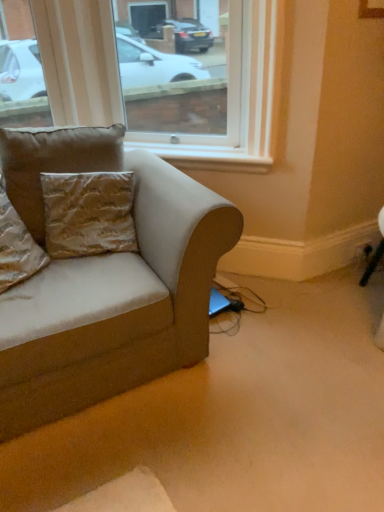
Describe the element at coordinates (364, 252) in the screenshot. This screenshot has height=512, width=384. I see `black plastic outlet at lower right` at that location.

Where is `white painted wood at upper center`? The image size is (384, 512). white painted wood at upper center is located at coordinates (209, 158).

Find the location of a particular element. This screenshot has width=384, height=512. suede-like beige couch at left is located at coordinates (106, 282).

From a real-world perspective, which object stands above the other?

From a 3D spatial view, suede-like beige couch at left is above.

Considering the sizes of objects black plastic outlet at lower right and suede-like beige couch at left in the image provided, who is wider, black plastic outlet at lower right or suede-like beige couch at left?

Wider between the two is suede-like beige couch at left.

Is suede-like beige couch at left inside black plastic outlet at lower right?

No, suede-like beige couch at left is not a part of black plastic outlet at lower right.

Considering the relative positions of black plastic outlet at lower right and suede-like beige couch at left in the image provided, is black plastic outlet at lower right to the left of suede-like beige couch at left from the viewer's perspective?

In fact, black plastic outlet at lower right is to the right of suede-like beige couch at left.

How many degrees apart are the facing directions of black plastic outlet at lower right and white painted wood at upper center?

There is a 40.5-degree angle between the facing directions of black plastic outlet at lower right and white painted wood at upper center.

Which is in front, point (366, 249) or point (145, 145)?

The point (145, 145) is closer to the camera.

Which of these two, black plastic outlet at lower right or white painted wood at upper center, stands shorter?

With less height is black plastic outlet at lower right.

Is black plastic outlet at lower right further to the viewer compared to white painted wood at upper center?

Yes, the depth of black plastic outlet at lower right is greater than that of white painted wood at upper center.

Consider the image. Does gold textured pillow at left, the 1th pillow viewed from the left, have a lesser height compared to white painted wood at upper center?

No, gold textured pillow at left, the 1th pillow viewed from the left, is not shorter than white painted wood at upper center.

Considering the points (14, 236) and (243, 150), which point is in front, point (14, 236) or point (243, 150)?

The point (14, 236) is closer.

Is gold textured pillow at left, positioned as the second pillow in right-to-left order, oriented towards white painted wood at upper center?

No, gold textured pillow at left, positioned as the second pillow in right-to-left order, is not facing towards white painted wood at upper center.

Does gold textured pillow at left, positioned as the second pillow in right-to-left order, have a larger size compared to white painted wood at upper center?

Yes.

Looking at this image, from a real-world perspective, is white painted wood at upper center physically below gold textured pillow at upper left, which is counted as the second pillow, starting from the left?

Yes, from a real-world perspective, white painted wood at upper center is under gold textured pillow at upper left, which is counted as the second pillow, starting from the left.

Can you confirm if white painted wood at upper center is shorter than gold textured pillow at upper left, which ranks as the first pillow in right-to-left order?

Yes.

Would you say white painted wood at upper center is outside gold textured pillow at upper left, which is counted as the second pillow, starting from the left?

Yes.

Does white painted wood at upper center have a lesser width compared to gold textured pillow at upper left, which ranks as the first pillow in right-to-left order?

Correct, the width of white painted wood at upper center is less than that of gold textured pillow at upper left, which ranks as the first pillow in right-to-left order.

Looking at this image, which of these two, gold textured pillow at upper left, which is counted as the second pillow, starting from the left, or white painted wood at upper center, stands taller?

gold textured pillow at upper left, which is counted as the second pillow, starting from the left, is taller.

From a real-world perspective, between gold textured pillow at upper left, which ranks as the first pillow in right-to-left order, and white painted wood at upper center, who is vertically lower?

white painted wood at upper center, from a real-world perspective.

Could you tell me if gold textured pillow at upper left, which ranks as the first pillow in right-to-left order, is facing white painted wood at upper center?

No, gold textured pillow at upper left, which ranks as the first pillow in right-to-left order, is not aimed at white painted wood at upper center.

This screenshot has width=384, height=512. Find the location of `pillow that is the 1st object located below the white painted wood at upper center (from the image's perspective)`. pillow that is the 1st object located below the white painted wood at upper center (from the image's perspective) is located at coordinates (53, 163).

Identify the location of window lying above the suede-like beige couch at left (from the image's perspective). (148, 73).

Who is taller, suede-like beige couch at left or transparent glass window at upper center?

With more height is suede-like beige couch at left.

Could you tell me if suede-like beige couch at left is turned towards transparent glass window at upper center?

No, suede-like beige couch at left does not turn towards transparent glass window at upper center.

Is suede-like beige couch at left outside of transparent glass window at upper center?

Yes.

Is white painted wood at upper center taller or shorter than transparent glass window at upper center?

Considering their sizes, white painted wood at upper center has less height than transparent glass window at upper center.

This screenshot has height=512, width=384. I want to click on window sill on the right side of transparent glass window at upper center, so click(x=209, y=158).

Do you think white painted wood at upper center is within transparent glass window at upper center, or outside of it?

white painted wood at upper center is outside transparent glass window at upper center.

Between white painted wood at upper center and transparent glass window at upper center, which one has larger size?

Bigger between the two is transparent glass window at upper center.

Identify the location of studio couch lying in front of the black plastic outlet at lower right. (106, 282).

Where is `window sill above the black plastic outlet at lower right (from the image's perspective)`? This screenshot has height=512, width=384. window sill above the black plastic outlet at lower right (from the image's perspective) is located at coordinates 209,158.

Estimate the real-world distances between objects in this image. Which object is closer to suede-like beige couch at left, transparent glass window at upper center or gold textured pillow at upper left, which is counted as the second pillow, starting from the left?

Based on the image, gold textured pillow at upper left, which is counted as the second pillow, starting from the left, appears to be nearer to suede-like beige couch at left.

Looking at the image, which one is located further to gold textured pillow at left, the 1th pillow viewed from the left, white painted wood at upper center or gold textured pillow at upper left, which is counted as the second pillow, starting from the left?

Based on the image, white painted wood at upper center appears to be further to gold textured pillow at left, the 1th pillow viewed from the left.

Which object lies further to the anchor point suede-like beige couch at left, transparent glass window at upper center or gold textured pillow at left, positioned as the second pillow in right-to-left order?

Based on the image, transparent glass window at upper center appears to be further to suede-like beige couch at left.

From the picture: Which object lies further to the anchor point white painted wood at upper center, transparent glass window at upper center or gold textured pillow at left, positioned as the second pillow in right-to-left order?

The object further to white painted wood at upper center is transparent glass window at upper center.

When comparing their distances from transparent glass window at upper center, does suede-like beige couch at left or gold textured pillow at upper left, which is counted as the second pillow, starting from the left, seem closer?

gold textured pillow at upper left, which is counted as the second pillow, starting from the left, lies closer to transparent glass window at upper center than the other object.

When comparing their distances from black plastic outlet at lower right, does suede-like beige couch at left or transparent glass window at upper center seem closer?

suede-like beige couch at left lies closer to black plastic outlet at lower right than the other object.

Considering their positions, is gold textured pillow at left, positioned as the second pillow in right-to-left order, positioned further to black plastic outlet at lower right than white painted wood at upper center?

Based on the image, gold textured pillow at left, positioned as the second pillow in right-to-left order, appears to be further to black plastic outlet at lower right.

Which object lies nearer to the anchor point gold textured pillow at upper left, which ranks as the first pillow in right-to-left order, suede-like beige couch at left or gold textured pillow at left, positioned as the second pillow in right-to-left order?

gold textured pillow at left, positioned as the second pillow in right-to-left order, lies closer to gold textured pillow at upper left, which ranks as the first pillow in right-to-left order, than the other object.

Locate an element on the screen. The image size is (384, 512). window located between gold textured pillow at left, positioned as the second pillow in right-to-left order, and white painted wood at upper center in the left-right direction is located at coordinates (148, 73).

Locate an element on the screen. The height and width of the screenshot is (512, 384). window located between gold textured pillow at left, the 1th pillow viewed from the left, and black plastic outlet at lower right in the left-right direction is located at coordinates (148, 73).

Find the location of a particular element. This screenshot has height=512, width=384. window sill between transparent glass window at upper center and black plastic outlet at lower right from left to right is located at coordinates (209, 158).

Locate an element on the screen. This screenshot has width=384, height=512. pillow located between gold textured pillow at left, the 1th pillow viewed from the left, and black plastic outlet at lower right in the left-right direction is located at coordinates (53, 163).